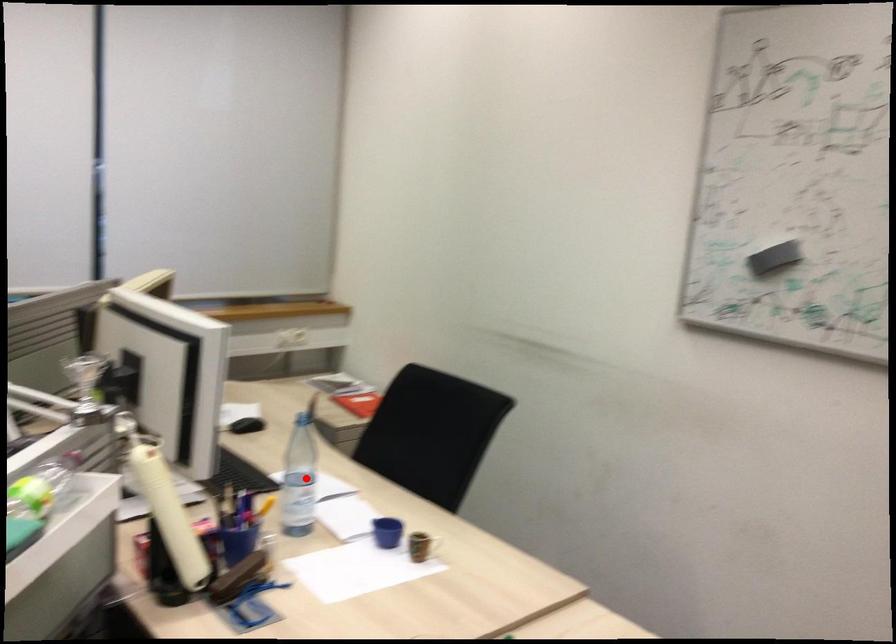
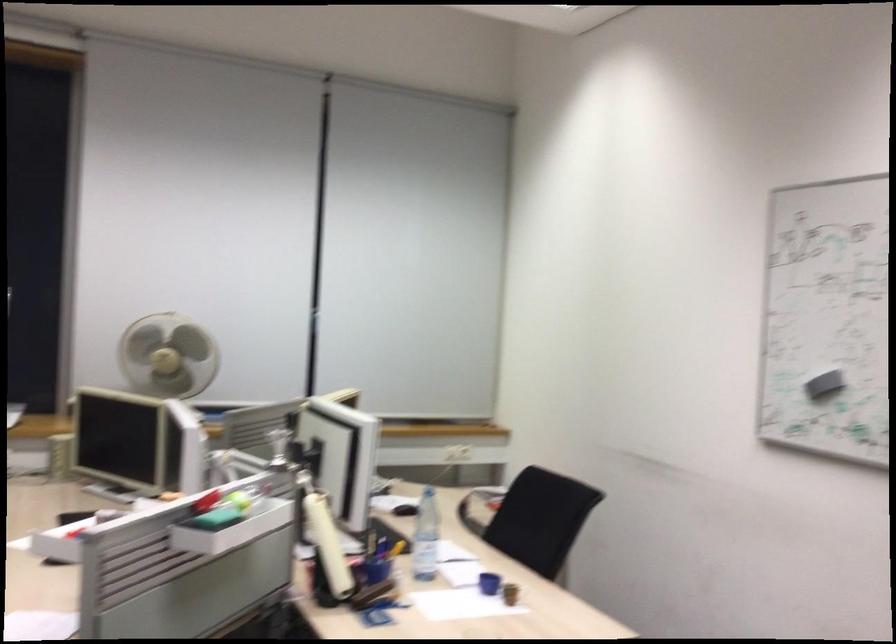
Where in the second image is the point corresponding to the highlighted location from the first image?

(426, 536)